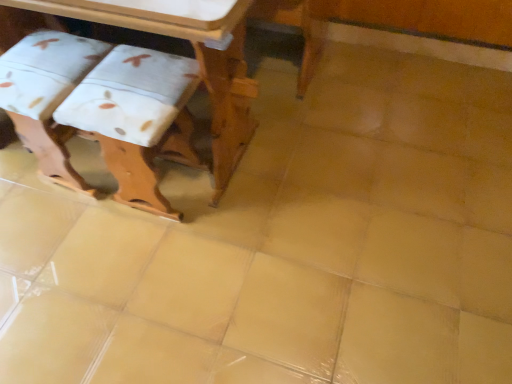
Question: Is white fabric step stool at lower left, arranged as the 2th step stool when viewed from the right, oriented towards wooden table at upper left?

Choices:
 (A) yes
 (B) no

Answer: (A)

Question: From the image's perspective, is white fabric step stool at lower left, marked as the 1th step stool in a left-to-right arrangement, located beneath wooden table at upper left?

Choices:
 (A) yes
 (B) no

Answer: (A)

Question: Is white fabric step stool at lower left, marked as the 1th step stool in a left-to-right arrangement, outside wooden table at upper left?

Choices:
 (A) yes
 (B) no

Answer: (B)

Question: Is white fabric step stool at lower left, marked as the 1th step stool in a left-to-right arrangement, further to camera compared to wooden table at upper left?

Choices:
 (A) yes
 (B) no

Answer: (A)

Question: Is white fabric step stool at lower left, arranged as the 2th step stool when viewed from the right, closer to the viewer compared to wooden table at upper left?

Choices:
 (A) no
 (B) yes

Answer: (A)

Question: Is white fabric step stool at lower left, arranged as the 2th step stool when viewed from the right, bigger than wooden table at upper left?

Choices:
 (A) no
 (B) yes

Answer: (A)

Question: From a real-world perspective, is white fabric step stool at left, which is counted as the second step stool, starting from the left, physically above wooden table at upper left?

Choices:
 (A) no
 (B) yes

Answer: (A)

Question: Can you confirm if white fabric step stool at left, arranged as the 1th step stool when viewed from the right, is thinner than wooden table at upper left?

Choices:
 (A) yes
 (B) no

Answer: (A)

Question: Is white fabric step stool at left, which is counted as the second step stool, starting from the left, positioned before wooden table at upper left?

Choices:
 (A) no
 (B) yes

Answer: (A)

Question: Is wooden table at upper left surrounded by white fabric step stool at left, arranged as the 1th step stool when viewed from the right?

Choices:
 (A) yes
 (B) no

Answer: (B)

Question: Is white fabric step stool at left, which is counted as the second step stool, starting from the left, bigger than wooden table at upper left?

Choices:
 (A) yes
 (B) no

Answer: (B)

Question: From a real-world perspective, is white fabric step stool at left, which is counted as the second step stool, starting from the left, located beneath wooden table at upper left?

Choices:
 (A) no
 (B) yes

Answer: (B)

Question: From the image's perspective, does white fabric step stool at lower left, arranged as the 2th step stool when viewed from the right, appear higher than white fabric step stool at left, which is counted as the second step stool, starting from the left?

Choices:
 (A) yes
 (B) no

Answer: (A)